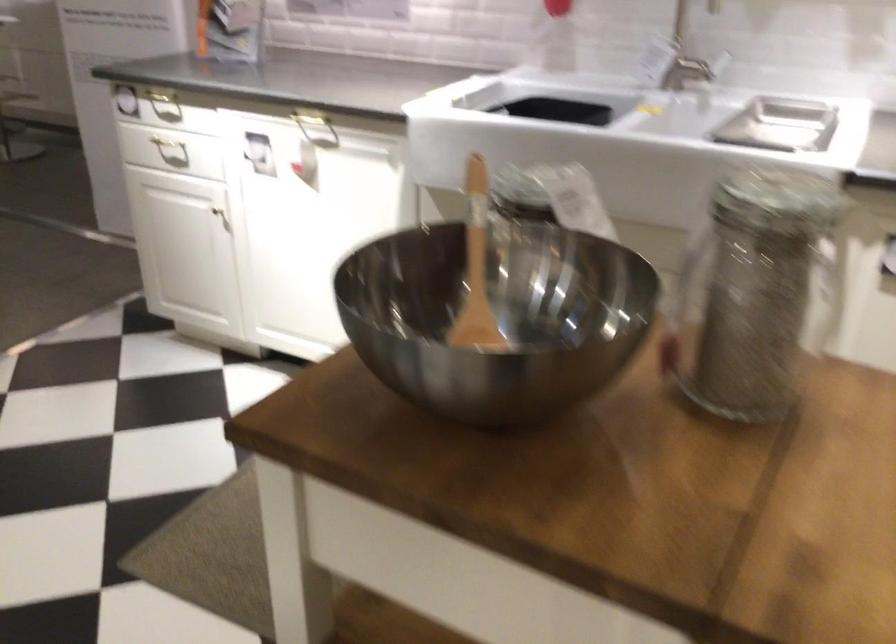
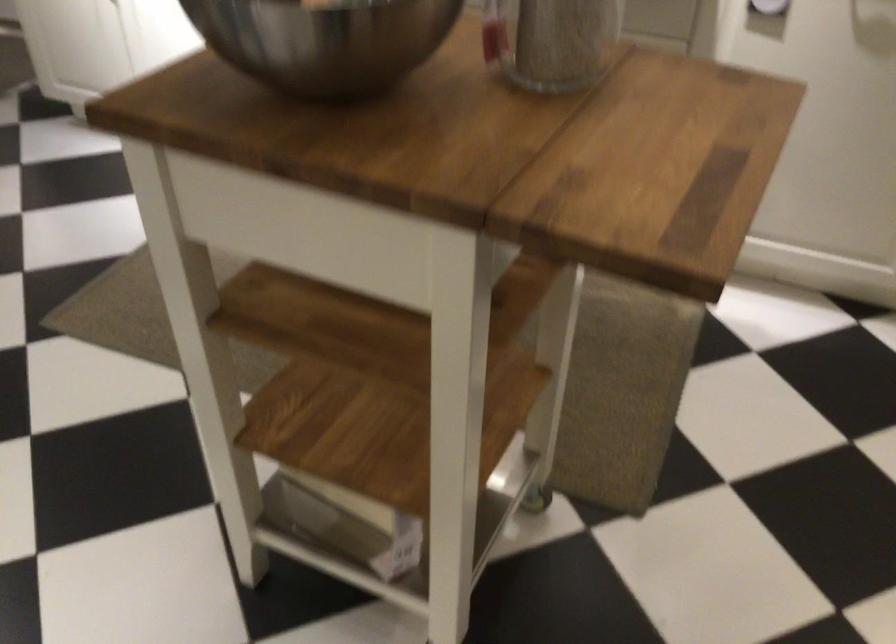
Locate, in the second image, the point that corresponds to (496,381) in the first image.

(323, 41)